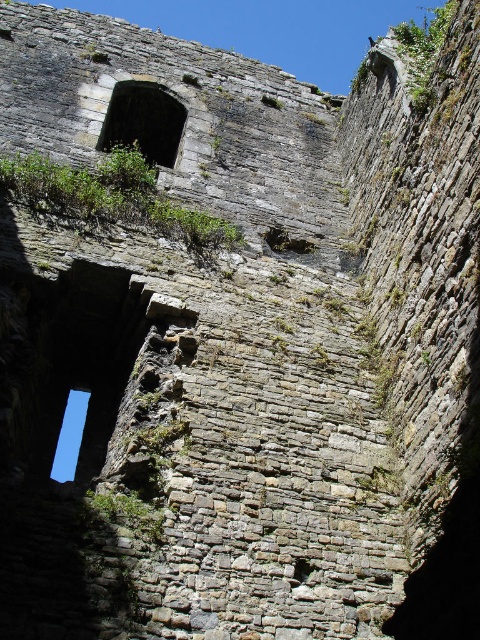
You are standing inside an ancient stone structure and notice a point marked at coordinates (112,196). Based on the scene description, what type of surface is this point located on?

The point at (112,196) is located on the green mossy wall at upper center.

You are an archaeologist examining the ancient stone structure. You notice the green mossy wall at upper center and the stone textured window at upper center. Which object is closer to you from your current viewpoint?

The green mossy wall at upper center is closer to you because it is in front of the stone textured window at upper center.

You are an archaeologist examining the ancient stone structure. You notice the green mossy wall at upper center. Based on its position, can you determine if it is closer to the rectangular window at bottom left or the other opening in the wall?

The green mossy wall at upper center is located at point (x=112, y=196), which places it closer to the rectangular window at bottom left compared to the other opening in the wall.